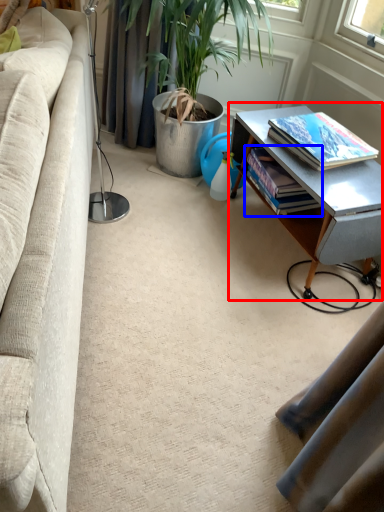
Question: Which of the following is the farthest to the observer, table (highlighted by a red box) or book (highlighted by a blue box)?

Choices:
 (A) table
 (B) book

Answer: (B)